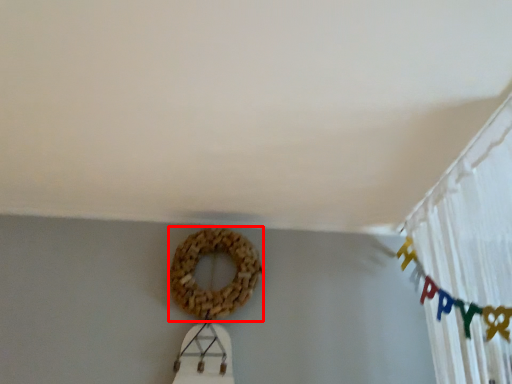
Question: Considering the relative positions of bagel (annotated by the red box) and curtain in the image provided, where is bagel (annotated by the red box) located with respect to the staircase?

Choices:
 (A) right
 (B) left

Answer: (B)